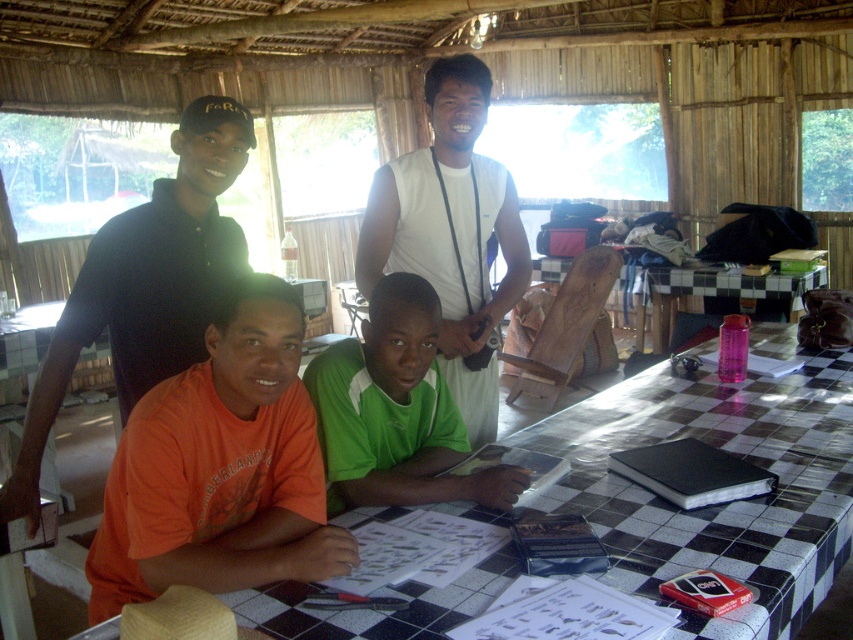
You are standing at the entrance of the bamboo structure and see two people seated at the table. One is wearing an orange cotton shirt at lower left and the other a matte black polo shirt at upper left. Which person is sitting closer to the ground?

The orange cotton shirt at lower left is sitting closer to the ground because it is positioned below the matte black polo shirt at upper left.

You are standing at the point labeled as point (160, 486) and want to walk to the exit located at point (730, 522). Is the exit behind you or in front of you?

The exit at point (730, 522) is behind you relative to your current position at point (160, 486), so it is behind you.